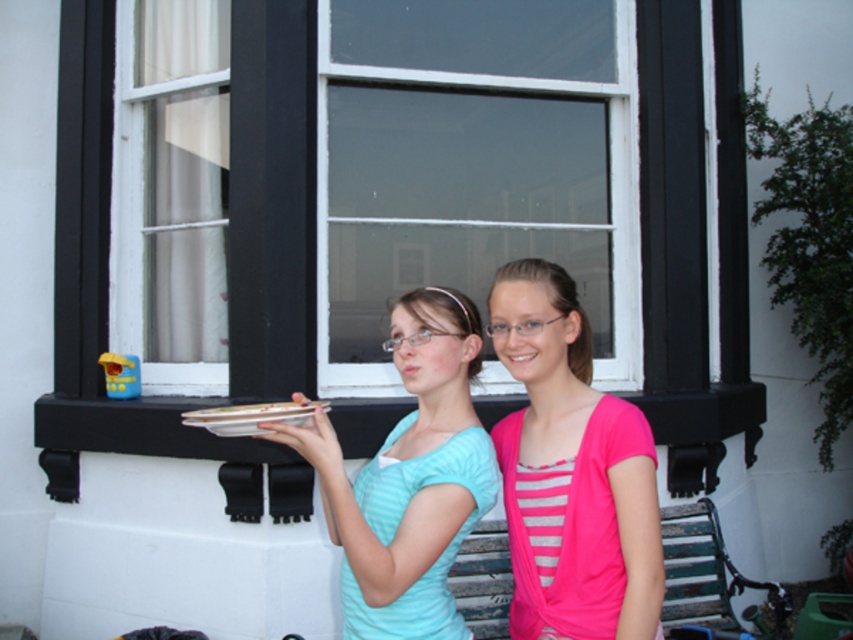
Question: Which of the following is the farthest from the observer?

Choices:
 (A) (305, 412)
 (B) (107, 227)

Answer: (B)

Question: Which point is closer to the camera?

Choices:
 (A) (434, 445)
 (B) (148, 193)
 (C) (183, 422)
 (D) (502, 362)

Answer: (A)

Question: Is the position of white plastic window at center more distant than that of pink matte cardigan at center?

Choices:
 (A) yes
 (B) no

Answer: (A)

Question: Does white plastic window at center appear over pink matte cardigan at center?

Choices:
 (A) no
 (B) yes

Answer: (B)

Question: Does white plastic window at center appear on the left side of white glossy platter at center?

Choices:
 (A) no
 (B) yes

Answer: (A)

Question: Among these points, which one is nearest to the camera?

Choices:
 (A) (376, 20)
 (B) (619, 512)

Answer: (B)